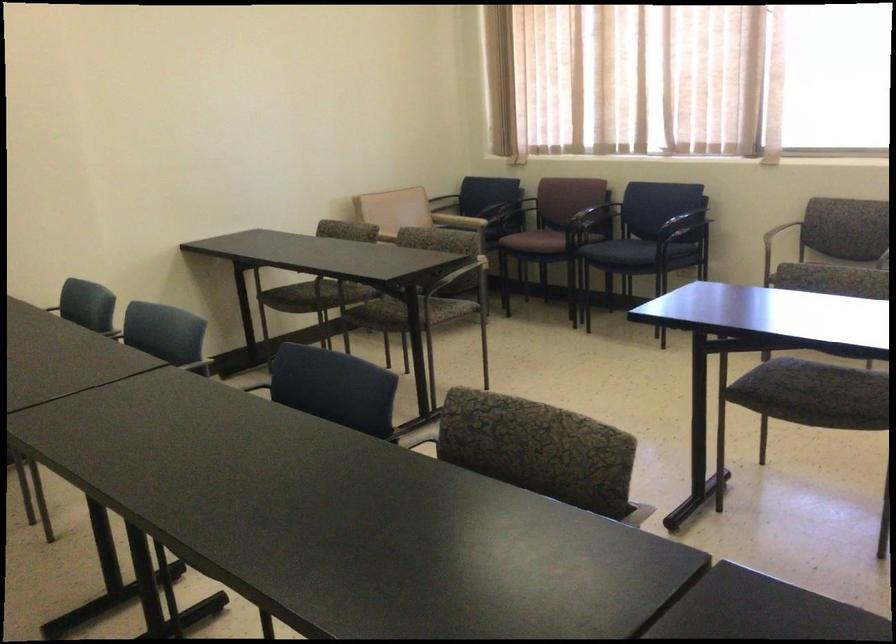
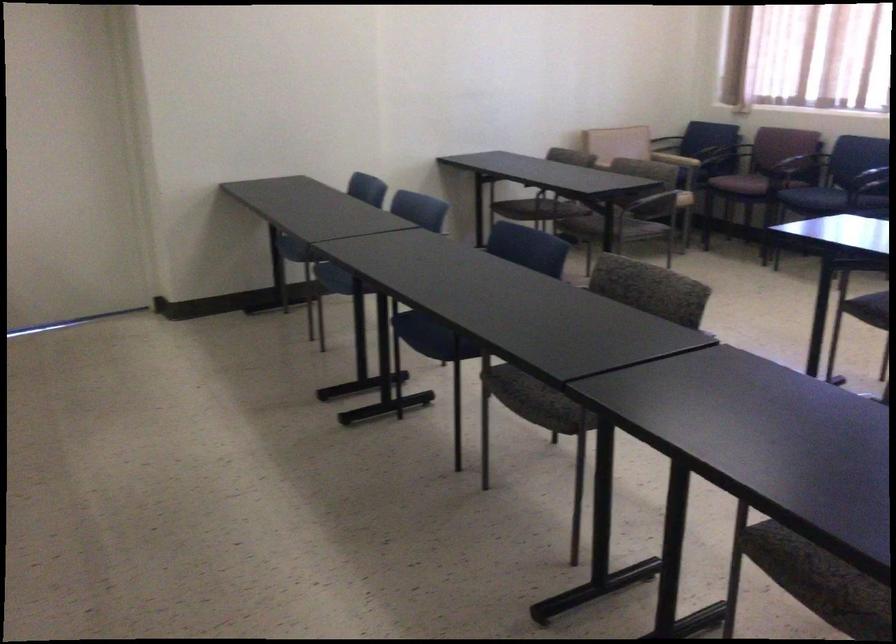
The point at [566,207] is marked in the first image. Where is the corresponding point in the second image?

(776, 156)